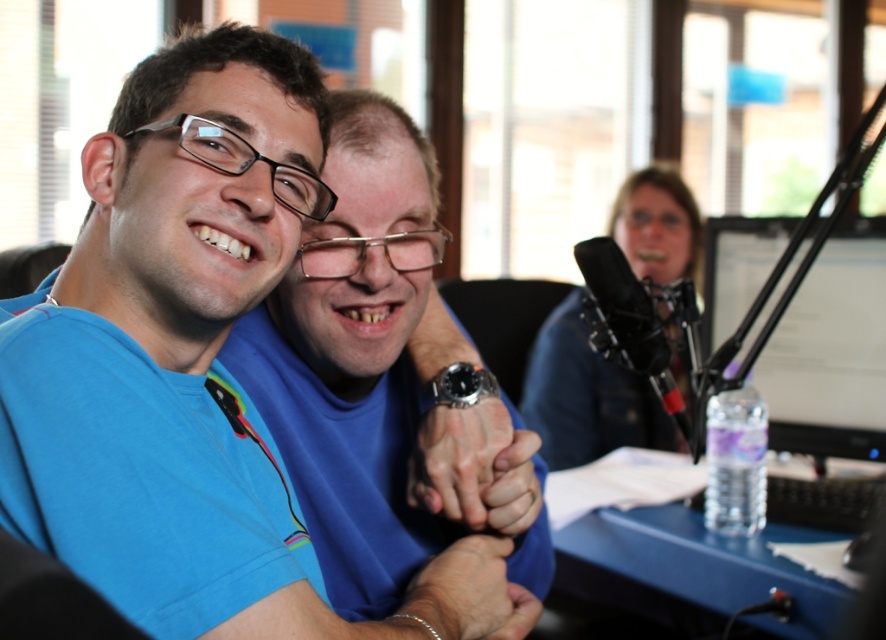
In the scene shown: You are a technician in the studio and need to adjust the settings on the matte black monitor at right. However, you notice the blue matte shirt at center is blocking your view. Can you move the shirt to access the monitor?

The blue matte shirt at center is below the matte black monitor at right, so you can easily move the shirt upward to access the monitor without any obstruction.

You are a guest entering the studio and need to place your laptop on the blue plastic table at lower right. Considering the size of the smooth skin hand at center, will the table be wide enough to accommodate your laptop?

The blue plastic table at lower right is wider than the smooth skin hand at center, so it should be wide enough to place your laptop.